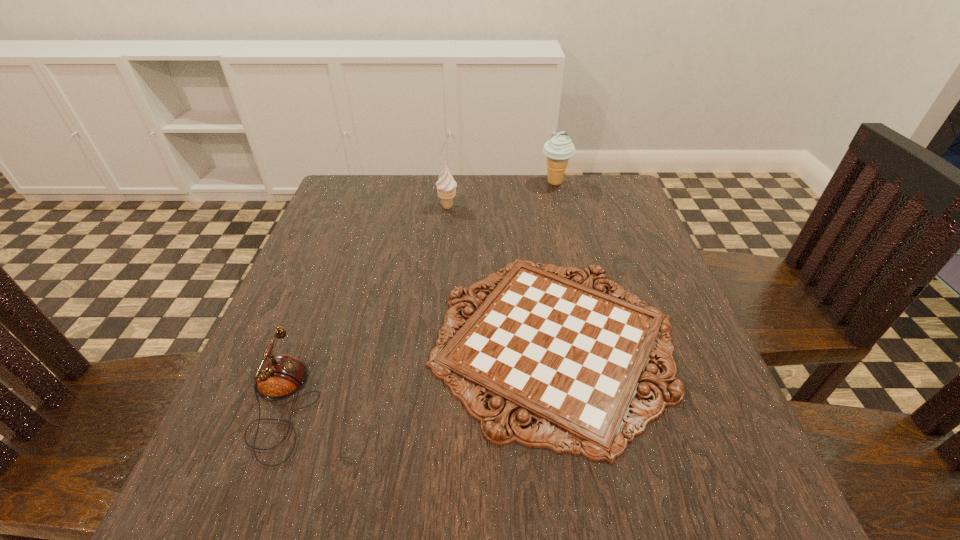
At what (x,y) coordinates should I click in order to perform the action: click on vacant area at the near edge of the desktop. Please return your answer as a coordinate pair (x, y). Image resolution: width=960 pixels, height=540 pixels. Looking at the image, I should click on tap(478, 462).

Locate an element on the screen. The width and height of the screenshot is (960, 540). free space at the left edge of the desktop is located at coordinates (286, 450).

What are the coordinates of `vacant region at the right edge of the desktop` in the screenshot? It's located at (674, 305).

Where is `vacant region at the far left corner`? The width and height of the screenshot is (960, 540). vacant region at the far left corner is located at coordinates pos(379,214).

The height and width of the screenshot is (540, 960). In the image, there is a desktop. Identify the location of vacant space at the far right corner. (594, 215).

Identify the location of vacant area that lies between the shortest object and the farther icecream. Image resolution: width=960 pixels, height=540 pixels. (555, 262).

Identify the location of free area in between the chessboard and the telephone. (418, 373).

Locate an element on the screen. vacant space in between the farthest object and the chessboard is located at coordinates (555, 262).

Locate an element on the screen. This screenshot has width=960, height=540. free spot between the tallest object and the leftmost object is located at coordinates (419, 294).

Find the location of a particular element. The height and width of the screenshot is (540, 960). free space between the telephone and the tallest object is located at coordinates (419, 294).